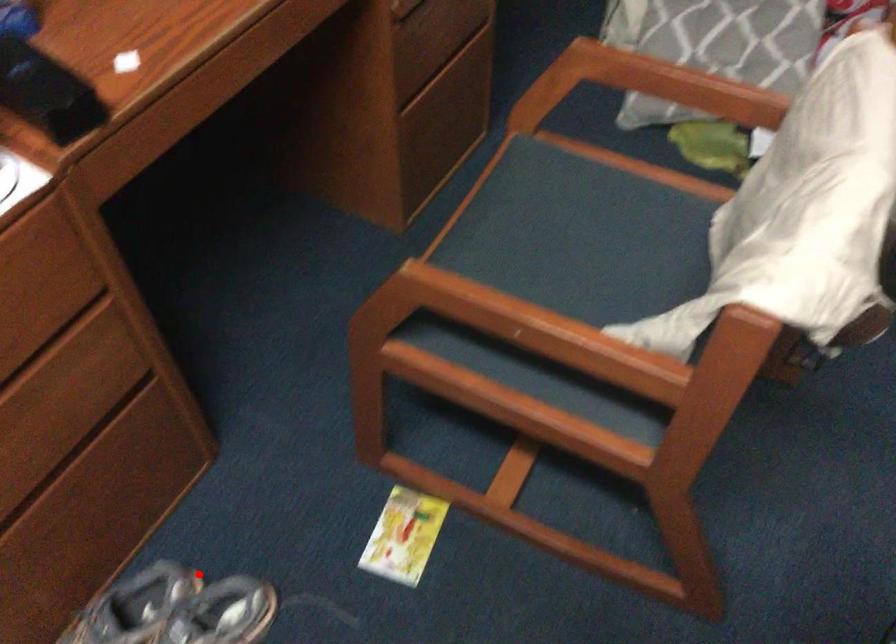
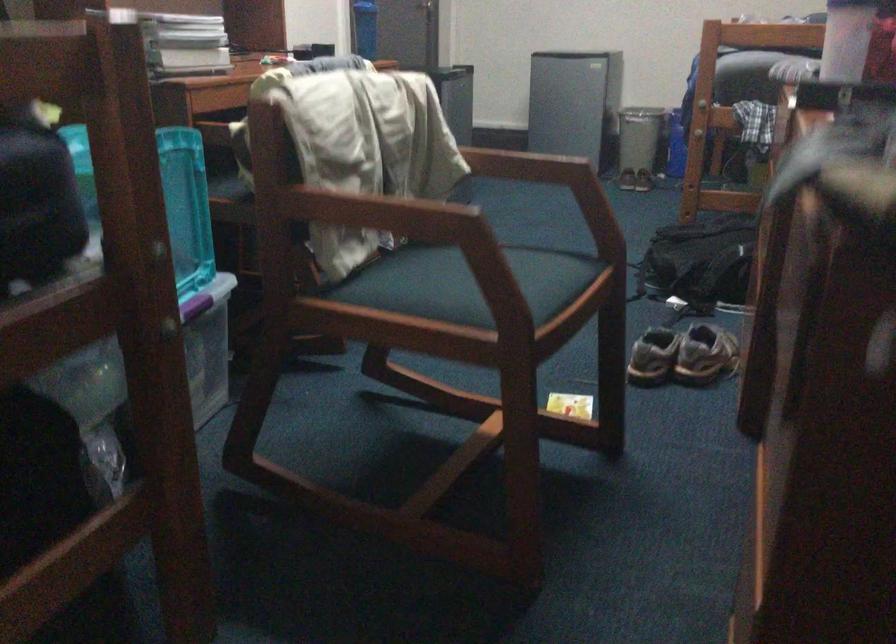
Question: I am providing you with two images of the same scene from different viewpoints. A red point is shown in image1. For the corresponding object point in image2, is it positioned nearer or farther from the camera?

Choices:
 (A) Nearer
 (B) Farther

Answer: (B)